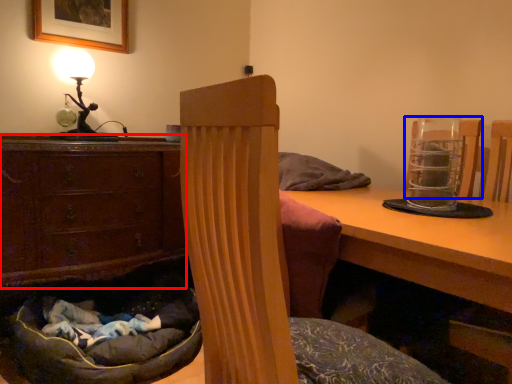
Question: Which object is closer to the camera taking this photo, chest of drawers (highlighted by a red box) or armchair (highlighted by a blue box)?

Choices:
 (A) chest of drawers
 (B) armchair

Answer: (B)